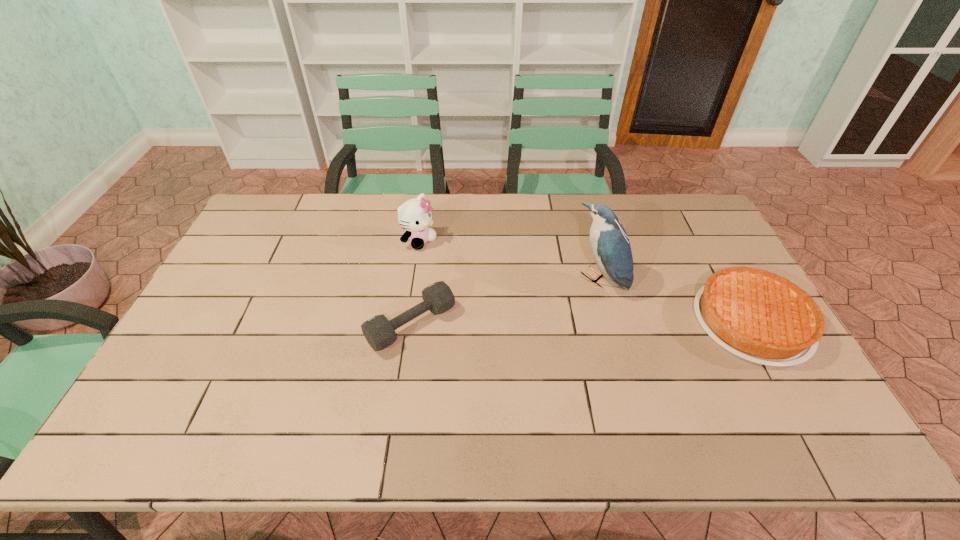
Where is `dumbbell`? The height and width of the screenshot is (540, 960). dumbbell is located at coordinates (379, 332).

The height and width of the screenshot is (540, 960). In order to click on pie in this screenshot , I will do `click(761, 317)`.

You are a GUI agent. You are given a task and a screenshot of the screen. Output one action in this format:
    pyautogui.click(x=<x>, y=<y>)
    Task: Click on the bird
    
    Given the screenshot: What is the action you would take?
    pyautogui.click(x=610, y=245)

You are a GUI agent. You are given a task and a screenshot of the screen. Output one action in this format:
    pyautogui.click(x=<x>, y=<y>)
    Task: Click on the third object from left to right
    Image resolution: width=960 pixels, height=540 pixels.
    Given the screenshot: What is the action you would take?
    (x=610, y=245)

This screenshot has width=960, height=540. In order to click on the farthest object in this screenshot , I will do `click(414, 215)`.

Where is `the second tallest object`? The image size is (960, 540). the second tallest object is located at coordinates click(x=414, y=215).

Locate an element on the screen. The width and height of the screenshot is (960, 540). free space located on the left of the dumbbell is located at coordinates (322, 325).

Locate an element on the screen. vacant area situated 0.060m on the back of the rightmost object is located at coordinates (722, 268).

At what (x,y) coordinates should I click in order to perform the action: click on vacant space situated 0.330m at the tip of the bird's beak. Please return your answer as a coordinate pair (x, y). This screenshot has width=960, height=540. Looking at the image, I should click on (501, 351).

Where is `vacant region located at the tip of the bird's beak`? The width and height of the screenshot is (960, 540). vacant region located at the tip of the bird's beak is located at coordinates (558, 310).